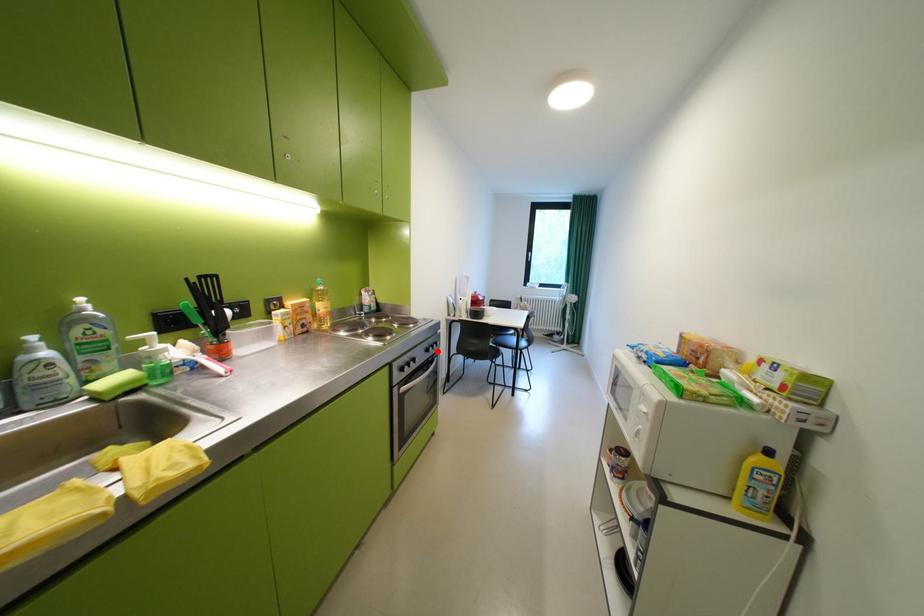
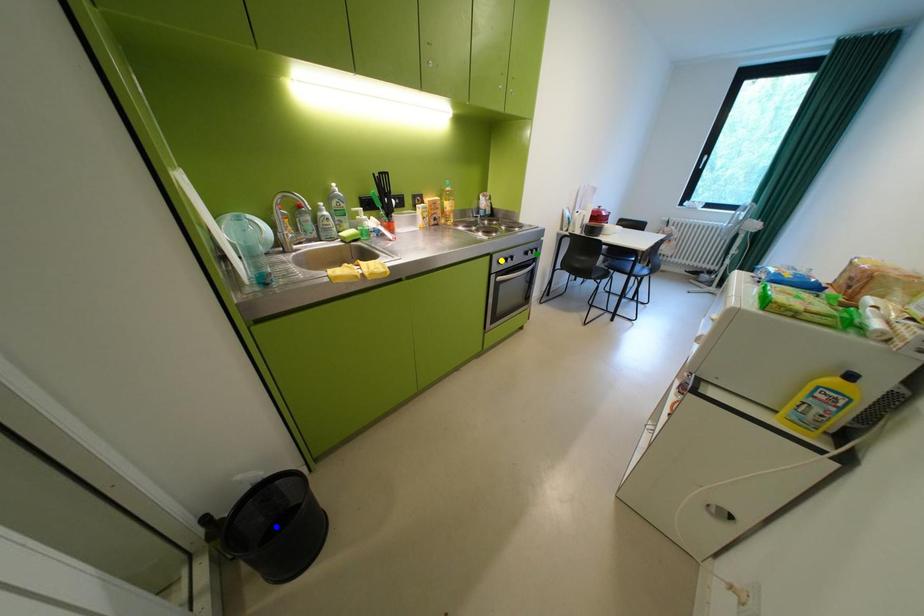
Question: I am providing you with two images of the same scene from different viewpoints. A red point is marked on the first image. You are given multiple points on the second image. Which spot in image 2 lines up with the point in image 1?

Choices:
 (A) green point
 (B) blue point
 (C) yellow point

Answer: (A)